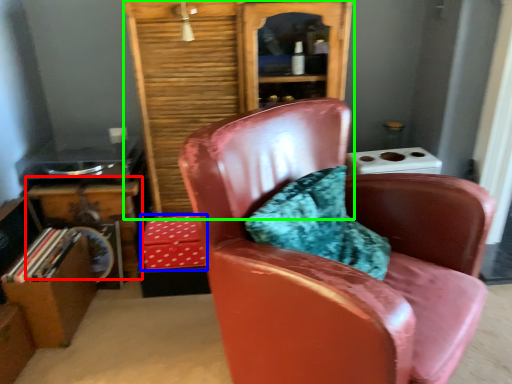
Question: Based on their relative distances, which object is nearer to table (highlighted by a red box)? Choose from box (highlighted by a blue box) and bookcase (highlighted by a green box).

Choices:
 (A) box
 (B) bookcase

Answer: (A)